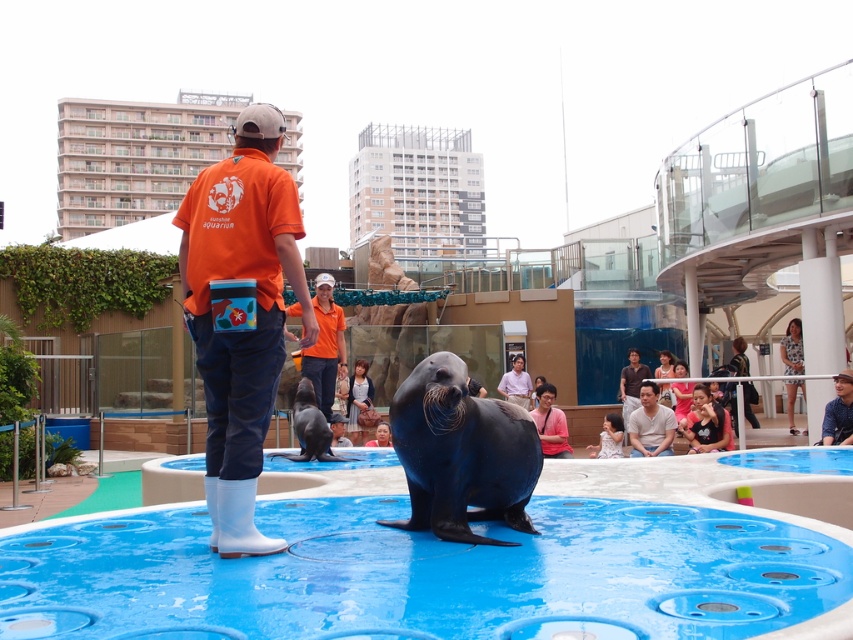
You are a visitor at the marine park and want to take a photo of the seal. You notice the blue rubber pool at center and the matte black jacket at lower right. Which object should you focus on to ensure the seal is in the frame?

The blue rubber pool at center is wider than the matte black jacket at lower right, so focusing on the blue rubber pool at center will ensure the seal is in the frame since it is wider and likely occupies more space in the image.